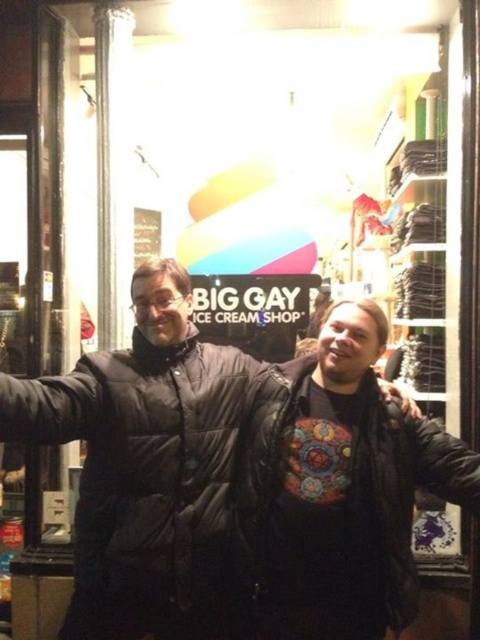
Is point (167, 513) less distant than point (396, 461)?

No, it is not.

In the scene shown: Is black puffy jacket at center in front of leather jacket at center?

Yes, black puffy jacket at center is closer to the viewer.

Between point (171, 468) and point (264, 380), which one is positioned in front?

Positioned in front is point (171, 468).

Identify the location of black puffy jacket at center. (145, 465).